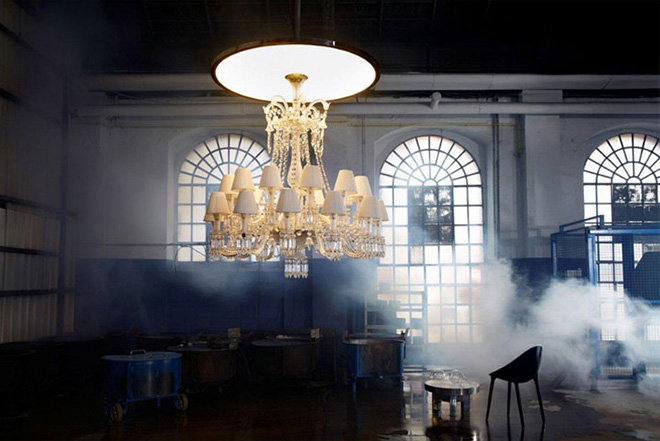
Locate an element on the screen. Image resolution: width=660 pixels, height=441 pixels. chair is located at coordinates (512, 365).